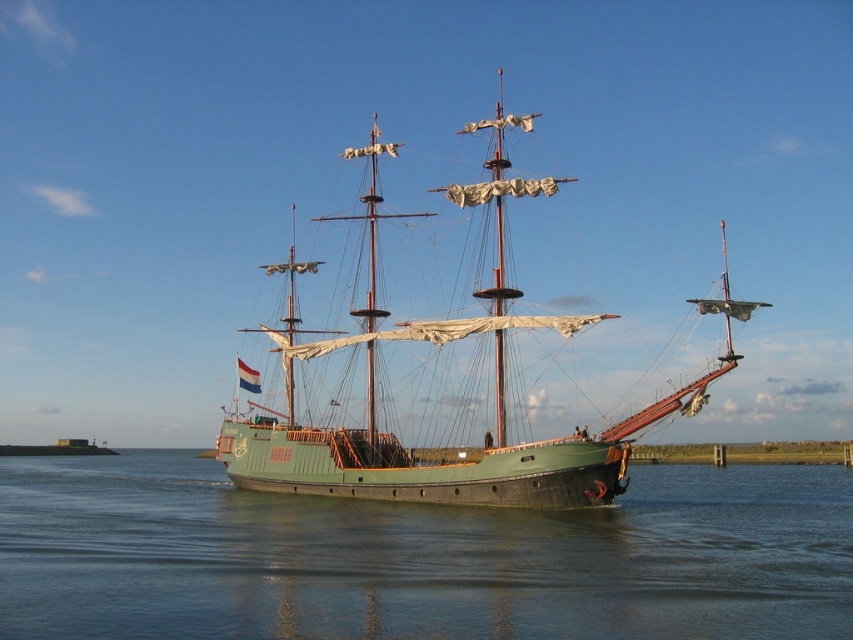
You are standing on the deck of the ship and want to move from the point at coordinates point (x=722, y=529) to the point at coordinates point (x=338, y=348). Since both points are on the deck, will you be moving towards the front or the back of the ship?

Since point (x=722, y=529) is closer to the viewer than point (x=338, y=348), moving from the former to the latter would mean moving towards the back of the ship.

You are a sailor on a ship that requires a minimum of 20 meters of open water to maneuver safely. Based on the scene, can you determine if there is enough space between the green matte water at center and the green matte sailboat at center to safely maneuver your ship?

The green matte water at center and green matte sailboat at center are 21.33 meters apart, which is more than the required 20 meters. Therefore, there is enough space to safely maneuver your ship.

You are an observer on the shore watching the green matte sailboat at center and the green matte water at center. Which object is positioned lower in the image?

The green matte water at center is located below the green matte sailboat at center, so it is positioned lower in the image.